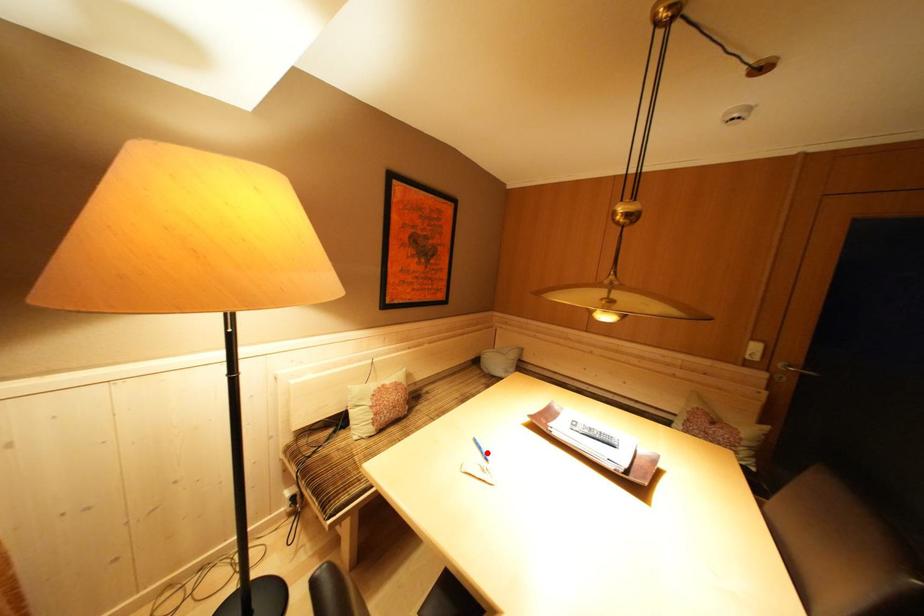
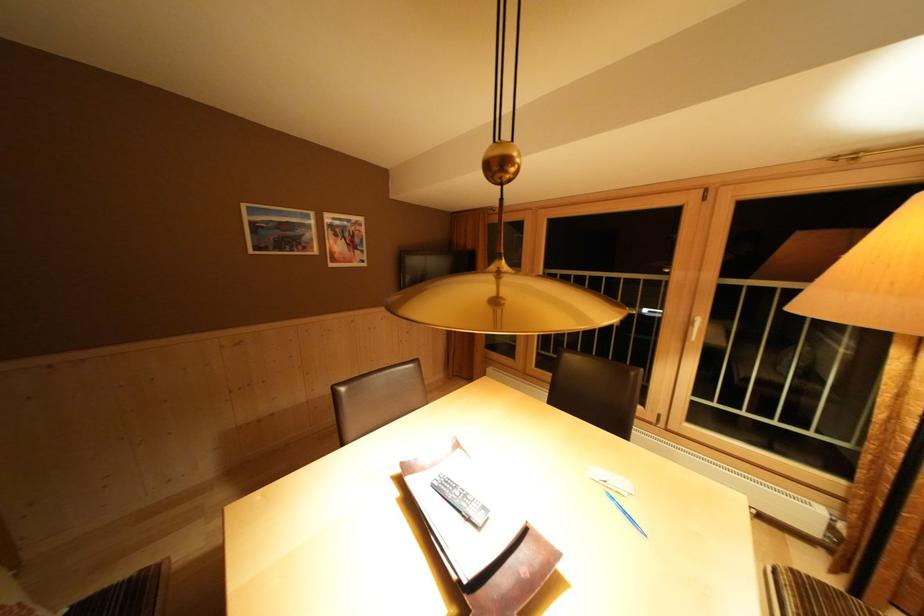
Where in the second image is the point corresponding to the highlighted location from the first image?

(633, 517)